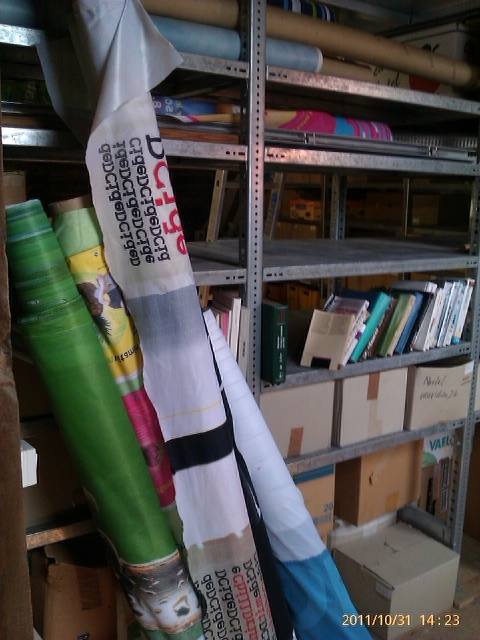
Question: Which point is closer to the camera?

Choices:
 (A) (440, 564)
 (B) (418, 460)

Answer: (A)

Question: Is cardboard box at center above brown cardboard box at center?

Choices:
 (A) no
 (B) yes

Answer: (A)

Question: Which of the following is the farthest from the observer?

Choices:
 (A) brown cardboard box at center
 (B) cardboard box at center

Answer: (A)

Question: Is cardboard box at center to the right of brown cardboard box at center from the viewer's perspective?

Choices:
 (A) no
 (B) yes

Answer: (B)

Question: Is cardboard box at center bigger than brown cardboard box at center?

Choices:
 (A) no
 (B) yes

Answer: (B)